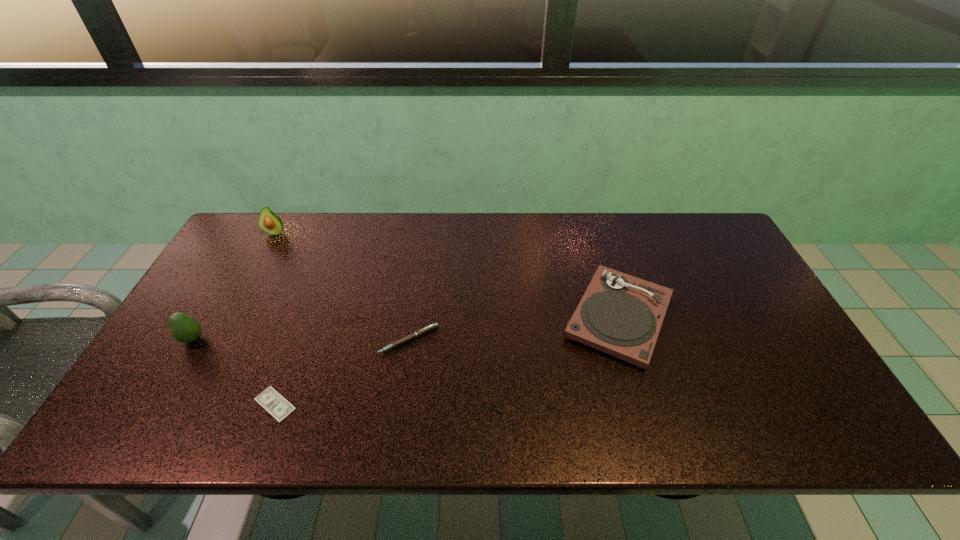
Find the location of a particular element. The height and width of the screenshot is (540, 960). the farther avocado is located at coordinates (269, 222).

Locate an element on the screen. This screenshot has width=960, height=540. the second tallest object is located at coordinates point(185,329).

This screenshot has width=960, height=540. I want to click on the nearer avocado, so click(185, 329).

Identify the location of phonograph_record. (621, 315).

Find the location of `the third shortest object`. the third shortest object is located at coordinates (621, 315).

Find the location of a particular element. The height and width of the screenshot is (540, 960). the second object from right to left is located at coordinates (424, 330).

Image resolution: width=960 pixels, height=540 pixels. I want to click on the fourth tallest object, so click(424, 330).

The image size is (960, 540). I want to click on the nearest object, so click(269, 399).

This screenshot has width=960, height=540. Find the location of `the shortest object`. the shortest object is located at coordinates (269, 399).

At what (x,y) coordinates should I click in order to perform the action: click on vacant area situated on the cut side of the farthest object. Please return your answer as a coordinate pair (x, y). Looking at the image, I should click on click(257, 266).